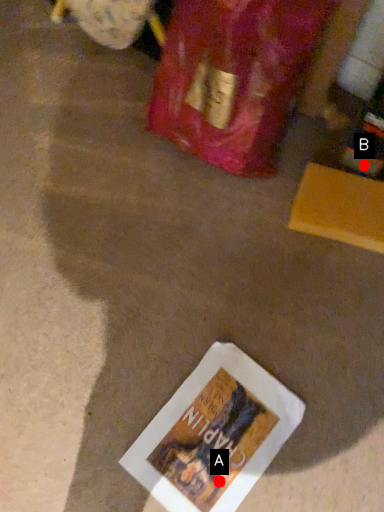
Question: Two points are circled on the image, labeled by A and B beside each circle. Which of the following is the closest to the observer?

Choices:
 (A) A is closer
 (B) B is closer

Answer: (A)